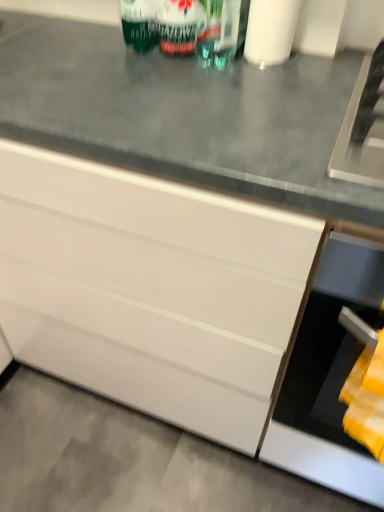
You are a GUI agent. You are given a task and a screenshot of the screen. Output one action in this format:
    pyautogui.click(x=<x>, y=<y>)
    Task: Click on the white matte toilet paper at upper center
    The image size is (384, 512).
    Given the screenshot: What is the action you would take?
    pyautogui.click(x=270, y=31)

What do you see at coordinates (152, 291) in the screenshot?
I see `white glossy cabinet at center` at bounding box center [152, 291].

This screenshot has height=512, width=384. What do you see at coordinates (222, 32) in the screenshot?
I see `green glass wine bottle at upper center` at bounding box center [222, 32].

Identify the location of black matte oven at lower right. (329, 376).

Can you see white matte toilet paper at upper center touching gray concrete floor at lower left?

No.

Is white matte toilet paper at upper center shorter than gray concrete floor at lower left?

No.

Choose the correct answer: Is white matte toilet paper at upper center inside gray concrete floor at lower left or outside it?

white matte toilet paper at upper center cannot be found inside gray concrete floor at lower left.

From a real-world perspective, is white matte toilet paper at upper center on top of gray concrete floor at lower left?

Yes, from a real-world perspective, white matte toilet paper at upper center is on top of gray concrete floor at lower left.

How distant is white matte toilet paper at upper center from white glossy cabinet at center?

64.70 centimeters.

Is white matte toilet paper at upper center completely or partially outside of white glossy cabinet at center?

Indeed, white matte toilet paper at upper center is completely outside white glossy cabinet at center.

From a real-world perspective, between white matte toilet paper at upper center and white glossy cabinet at center, who is vertically lower?

white glossy cabinet at center, from a real-world perspective.

From the image's perspective, between white matte toilet paper at upper center and white glossy cabinet at center, which one is located above?

From the image's view, white matte toilet paper at upper center is above.

Considering the relative positions of yellow fabric at lower right and gray concrete floor at lower left in the image provided, is yellow fabric at lower right to the right of gray concrete floor at lower left from the viewer's perspective?

Yes.

Does point (383, 434) lie in front of point (157, 465)?

Yes, point (383, 434) is in front of point (157, 465).

Is yellow fabric at lower right not near gray concrete floor at lower left?

No, yellow fabric at lower right is not far away from gray concrete floor at lower left.

Looking at the image, does yellow fabric at lower right seem bigger or smaller compared to gray concrete floor at lower left?

yellow fabric at lower right is smaller than gray concrete floor at lower left.

In the image, there is a green matte can at upper center. Where is `blanket below it (from a real-world perspective)`? This screenshot has height=512, width=384. blanket below it (from a real-world perspective) is located at coordinates (366, 400).

Which is nearer, (150, 40) or (362, 400)?

The point (362, 400) is closer.

Which is more to the right, green matte can at upper center or yellow fabric at lower right?

yellow fabric at lower right is more to the right.

Considering the relative sizes of yellow fabric at lower right and green glass wine bottle at upper center in the image provided, is yellow fabric at lower right shorter than green glass wine bottle at upper center?

Correct, yellow fabric at lower right is not as tall as green glass wine bottle at upper center.

Considering their positions, is yellow fabric at lower right located in front of or behind green glass wine bottle at upper center?

In the image, yellow fabric at lower right appears in front of green glass wine bottle at upper center.

Does point (381, 350) come in front of point (199, 3)?

Yes, it is.

From the image's perspective, does yellow fabric at lower right appear higher than green glass wine bottle at upper center?

No, from the image's perspective, yellow fabric at lower right is not on top of green glass wine bottle at upper center.

Which object is closer to the camera, green glass wine bottle at upper center or gray concrete floor at lower left?

Positioned in front is green glass wine bottle at upper center.

Based on the photo, which point is more distant from viewer, [243,15] or [26,484]?

The point [26,484] is more distant.

Is green glass wine bottle at upper center bigger or smaller than gray concrete floor at lower left?

Considering their sizes, green glass wine bottle at upper center takes up less space than gray concrete floor at lower left.

Is green glass wine bottle at upper center positioned beyond the bounds of gray concrete floor at lower left?

Yes, green glass wine bottle at upper center is located beyond the bounds of gray concrete floor at lower left.

How different are the orientations of green glass wine bottle at upper center and green matte can at upper center in degrees?

green glass wine bottle at upper center and green matte can at upper center are facing 0.000355 degrees away from each other.

Who is taller, green glass wine bottle at upper center or green matte can at upper center?

With more height is green glass wine bottle at upper center.

Considering the relative sizes of green glass wine bottle at upper center and green matte can at upper center in the image provided, is green glass wine bottle at upper center thinner than green matte can at upper center?

Yes.

In order to click on beverage on the left of green glass wine bottle at upper center in this screenshot , I will do `click(219, 29)`.

Locate an element on the screen. The width and height of the screenshot is (384, 512). concrete that is under the white matte toilet paper at upper center (from a real-world perspective) is located at coordinates (127, 459).

There is a white glossy cabinet at center. Where is `toilet paper above it (from a real-world perspective)`? This screenshot has width=384, height=512. toilet paper above it (from a real-world perspective) is located at coordinates (270, 31).

From the image, which object appears to be farther from gray concrete floor at lower left, black matte oven at lower right or yellow fabric at lower right?

yellow fabric at lower right.

When comparing their distances from gray concrete floor at lower left, does white glossy cabinet at center or black matte oven at lower right seem closer?

white glossy cabinet at center lies closer to gray concrete floor at lower left than the other object.

When comparing their distances from white glossy cabinet at center, does white matte toilet paper at upper center or green glass wine bottle at upper center seem closer?

Among the two, green glass wine bottle at upper center is located nearer to white glossy cabinet at center.

Consider the image. Estimate the real-world distances between objects in this image. Which object is closer to green glass wine bottle at upper center, white matte toilet paper at upper center or gray concrete floor at lower left?

white matte toilet paper at upper center lies closer to green glass wine bottle at upper center than the other object.

Looking at the image, which one is located closer to gray concrete floor at lower left, green matte can at upper center or green glass wine bottle at upper center?

green matte can at upper center is positioned closer to the anchor gray concrete floor at lower left.

When comparing their distances from yellow fabric at lower right, does gray concrete floor at lower left or green glass wine bottle at upper center seem further?

gray concrete floor at lower left is positioned further to the anchor yellow fabric at lower right.

Looking at the image, which one is located closer to green glass wine bottle at upper center, green matte can at upper center or yellow fabric at lower right?

green matte can at upper center lies closer to green glass wine bottle at upper center than the other object.

Which object lies further to the anchor point gray concrete floor at lower left, green glass wine bottle at upper center or green matte can at upper center?

green glass wine bottle at upper center is further to gray concrete floor at lower left.

Identify the location of toilet paper between green glass wine bottle at upper center and white glossy cabinet at center from top to bottom. (270, 31).

Where is `oven between white matte toilet paper at upper center and gray concrete floor at lower left vertically`? This screenshot has width=384, height=512. oven between white matte toilet paper at upper center and gray concrete floor at lower left vertically is located at coordinates (329, 376).

The image size is (384, 512). Identify the location of blanket located between gray concrete floor at lower left and black matte oven at lower right in the left-right direction. (366, 400).

Locate an element on the screen. The height and width of the screenshot is (512, 384). oven that lies between green matte can at upper center and gray concrete floor at lower left from top to bottom is located at coordinates (329, 376).